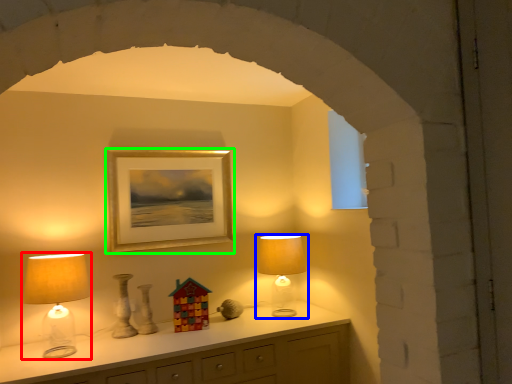
Question: Which is nearer to the lamp (highlighted by a red box)? lamp (highlighted by a blue box) or picture frame (highlighted by a green box).

Choices:
 (A) lamp
 (B) picture frame

Answer: (B)